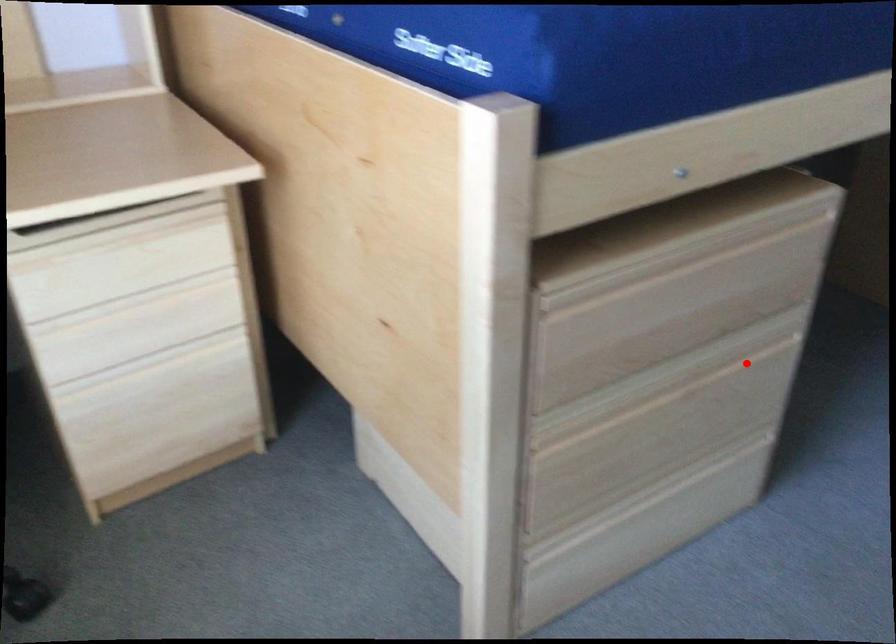
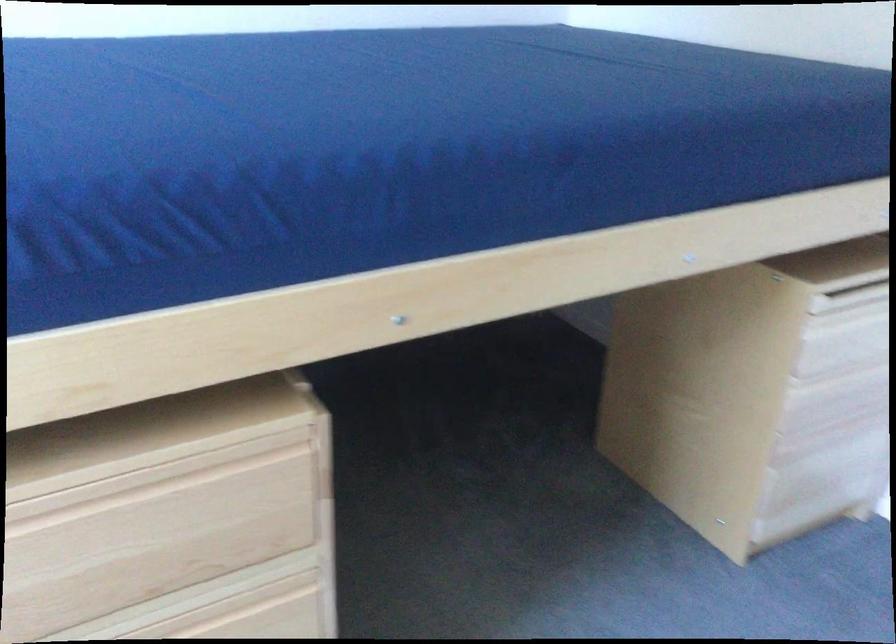
Where in the second image is the point corresponding to the highlighted location from the first image?

(253, 614)